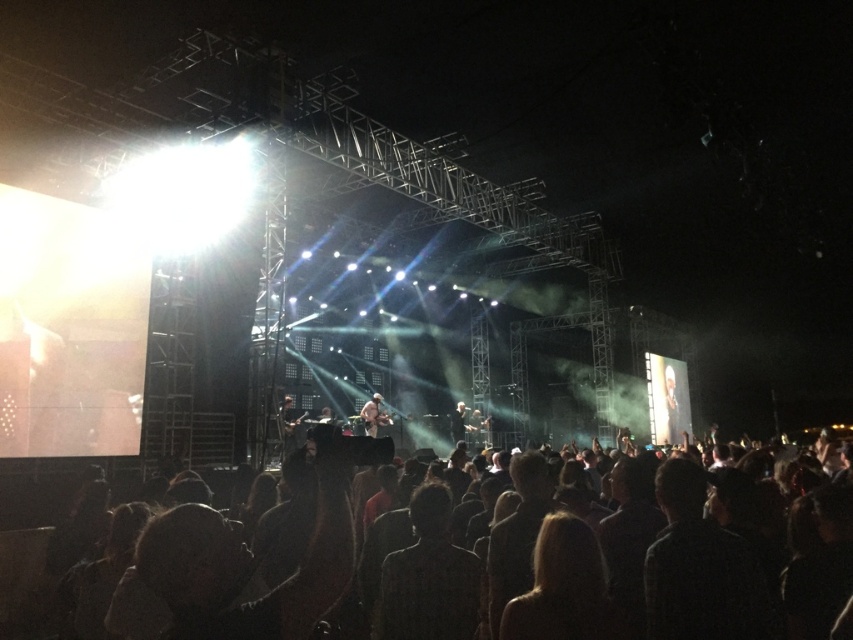
You are a photographer at the concert. You need to capture a photo where both the dark fabric head at lower right and the light brown leather jacket at center are visible. Based on their positions, which object should be in the foreground of your photo?

The light brown leather jacket at center should be in the foreground because the dark fabric head at lower right is located above it, meaning the jacket is closer to the camera.

You are a photographer at the concert and need to capture a clear shot of both the dark fabric at center and the light brown leather jacket at center. Since the camera can only focus on one object at a time, which object should you focus on to ensure it fills more of the frame?

The dark fabric at center is bigger than the light brown leather jacket at center, so focusing on the dark fabric at center will fill more of the frame.

You are a photographer at the concert and need to capture a clear shot of both the dark fabric at center and the light brown leather jacket at center. Since you want to ensure both are fully visible, which object should you focus on first to avoid cropping the other?

The dark fabric at center is shorter than the light brown leather jacket at center, so you should focus on the light brown leather jacket at center first to ensure it is fully visible before adjusting the frame for the shorter dark fabric at center.